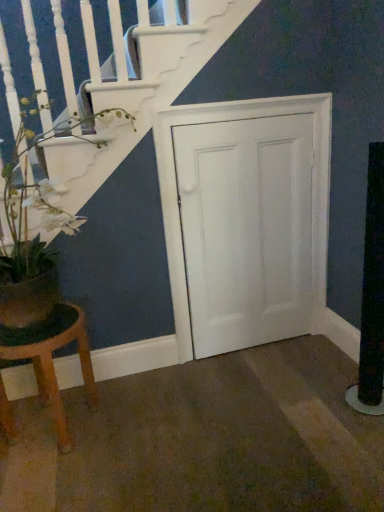
Question: Which is correct: wooden stool at lower left is inside white wood door at center, or outside of it?

Choices:
 (A) inside
 (B) outside

Answer: (B)

Question: From the image's perspective, is wooden stool at lower left located above or below white wood door at center?

Choices:
 (A) above
 (B) below

Answer: (B)

Question: Considering the real-world distances, which object is closest to the wooden stool at lower left?

Choices:
 (A) green matte plant at left
 (B) white wood door at center

Answer: (A)

Question: Estimate the real-world distances between objects in this image. Which object is farther from the green matte plant at left?

Choices:
 (A) white wood door at center
 (B) wooden stool at lower left

Answer: (A)